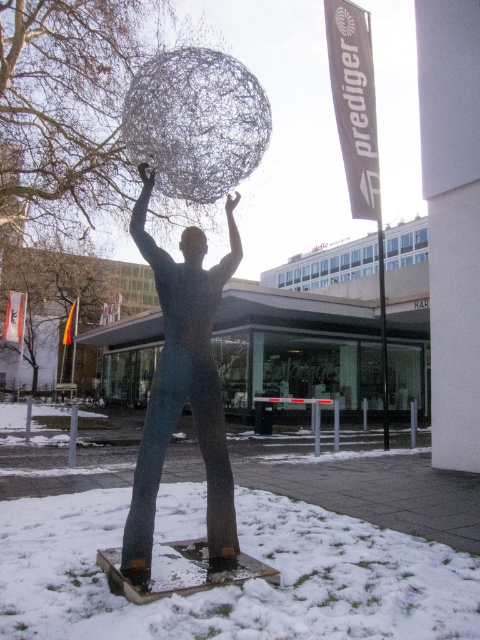
Can you confirm if metallic wire sculpture at center is smaller than smooth skin head at center?

Incorrect, metallic wire sculpture at center is not smaller in size than smooth skin head at center.

Between metallic wire sculpture at center and smooth skin head at center, which one is positioned lower?

metallic wire sculpture at center

Is point (222, 275) closer to camera compared to point (195, 256)?

No, it is behind (195, 256).

Locate an element on the screen. The image size is (480, 640). metallic wire sculpture at center is located at coordinates (182, 390).